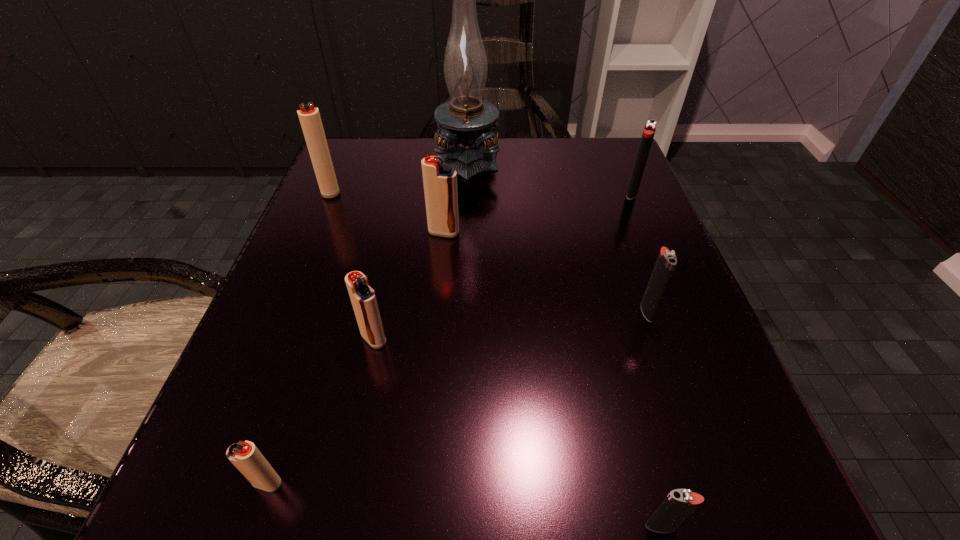
Where is `blank area located 0.280m on the front of the second igniter from right to left`? blank area located 0.280m on the front of the second igniter from right to left is located at coordinates (726, 537).

Where is `free space located 0.310m on the right of the fifth igniter from right to left`? Image resolution: width=960 pixels, height=540 pixels. free space located 0.310m on the right of the fifth igniter from right to left is located at coordinates (607, 339).

Identify the location of vacant space situated 0.180m on the right of the smallest red igniter. Image resolution: width=960 pixels, height=540 pixels. (446, 483).

The width and height of the screenshot is (960, 540). What are the coordinates of `vacant space located 0.390m on the back of the sixth object from left to right` in the screenshot? It's located at (592, 264).

At what (x,y) coordinates should I click in order to perform the action: click on oil lamp that is at the far edge. Please return your answer as a coordinate pair (x, y). Looking at the image, I should click on (467, 123).

Locate an element on the screen. object that is at the far left corner is located at coordinates (310, 120).

The image size is (960, 540). I want to click on object present at the near left corner, so (245, 456).

Locate an element on the screen. The width and height of the screenshot is (960, 540). object located at the far right corner is located at coordinates click(650, 127).

Where is `object present at the near right corner`? This screenshot has width=960, height=540. object present at the near right corner is located at coordinates (680, 503).

Where is `vacant position at the far edge of the desktop`? vacant position at the far edge of the desktop is located at coordinates (540, 165).